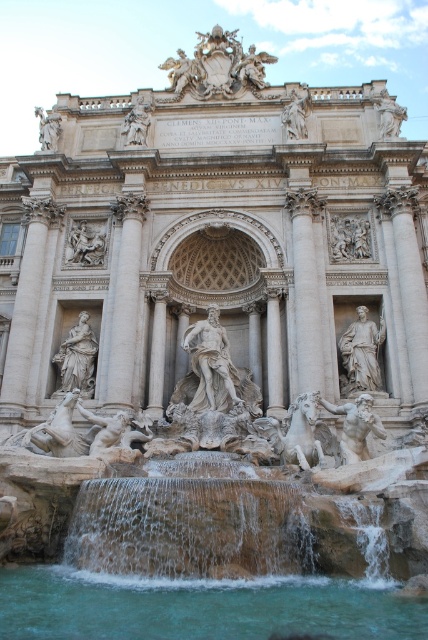
From the picture: You are visiting the Trevi Fountain and want to take a photo of both the white marble statue at right and the white marble statue at center. Which statue should you stand closer to in order to capture both in a single frame without zooming?

You should stand closer to the white marble statue at center because it is shorter than the white marble statue at right, allowing both to fit within the frame more easily when positioned closer to the shorter statue.

You are standing at the Trevi Fountain and want to know how far the point at coordinates (232, 573) is from where you are standing. Can you determine the distance?

The point at coordinates (232, 573) is 44.02 meters away from your current position.